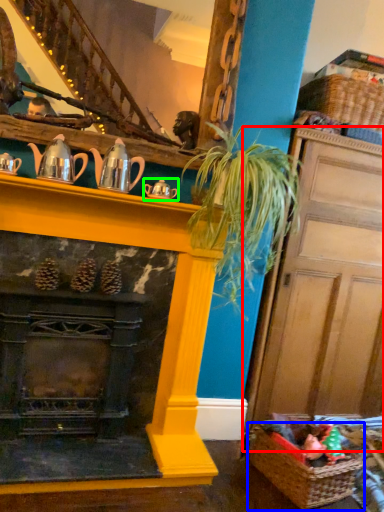
Question: Which object is positioned closest to door (highlighted by a red box)? Select from basket (highlighted by a blue box) and tea pot (highlighted by a green box).

Choices:
 (A) basket
 (B) tea pot

Answer: (A)